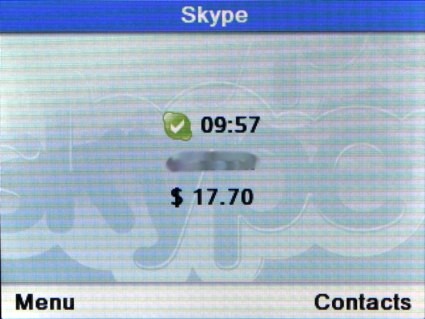
Find the location of `timer`. timer is located at coordinates pyautogui.click(x=220, y=127).